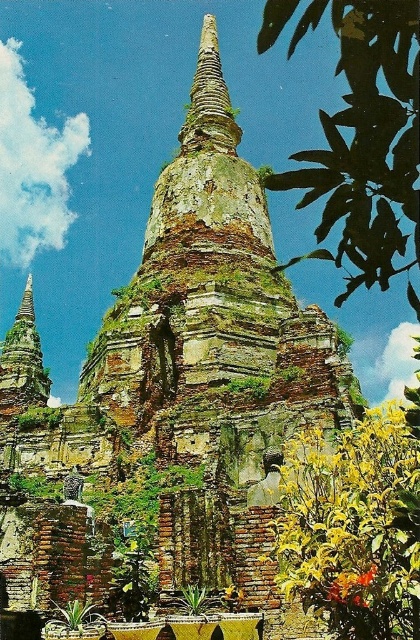
Question: Does green leafy plant at upper right appear on the left side of yellow-green leafy plant at lower center?

Choices:
 (A) no
 (B) yes

Answer: (A)

Question: Does green leafy plant at upper right have a larger size compared to yellow-green leafy plant at lower center?

Choices:
 (A) yes
 (B) no

Answer: (A)

Question: Which of the following is the farthest from the observer?

Choices:
 (A) tap(370, 157)
 (B) tap(320, 611)

Answer: (B)

Question: In this image, where is green leafy plant at upper right located relative to yellow-green leafy plant at lower center?

Choices:
 (A) below
 (B) above

Answer: (B)